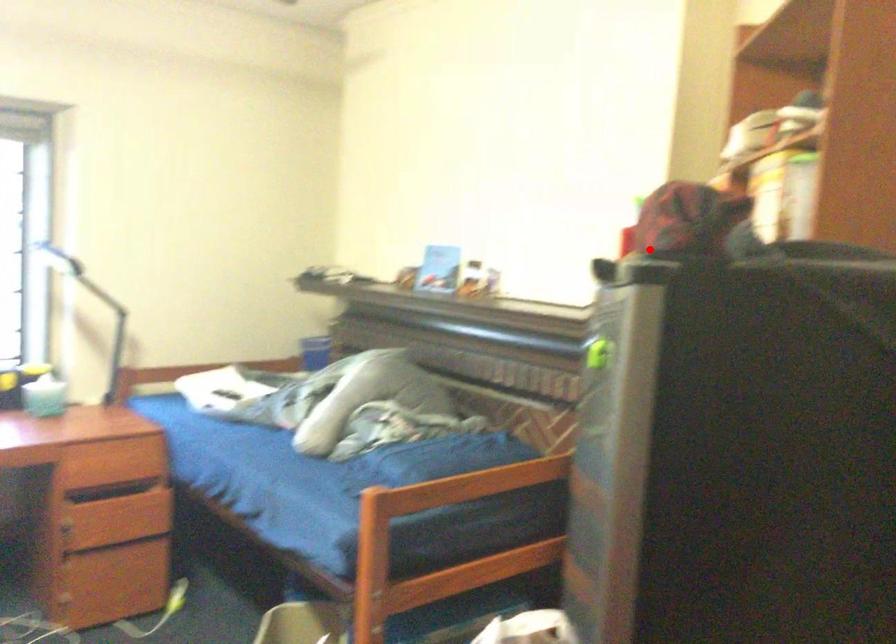
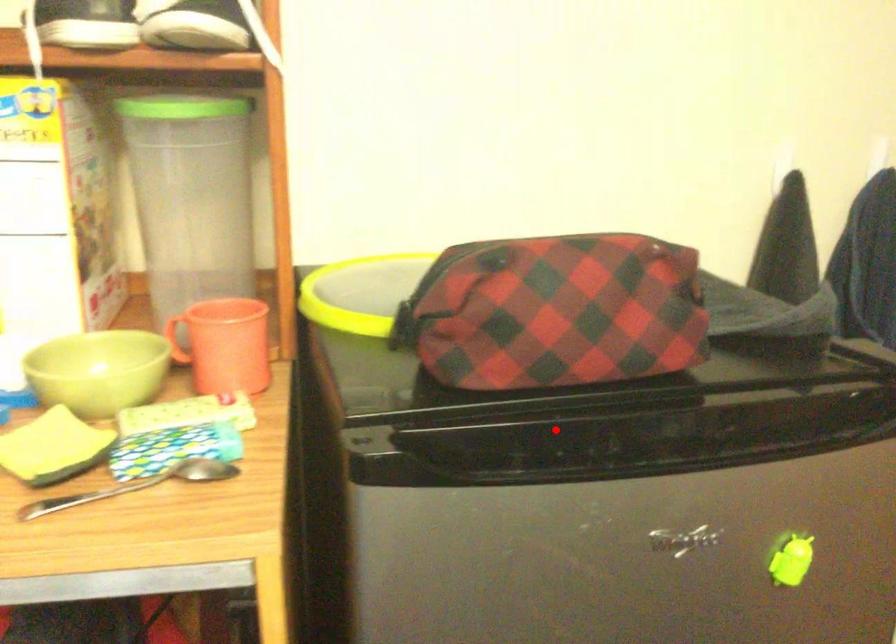
I am providing you with two images of the same scene from different viewpoints. A red point is marked on the first image and another point is marked on the second image. Is the red point in image1 aligned with the point shown in image2?

Yes